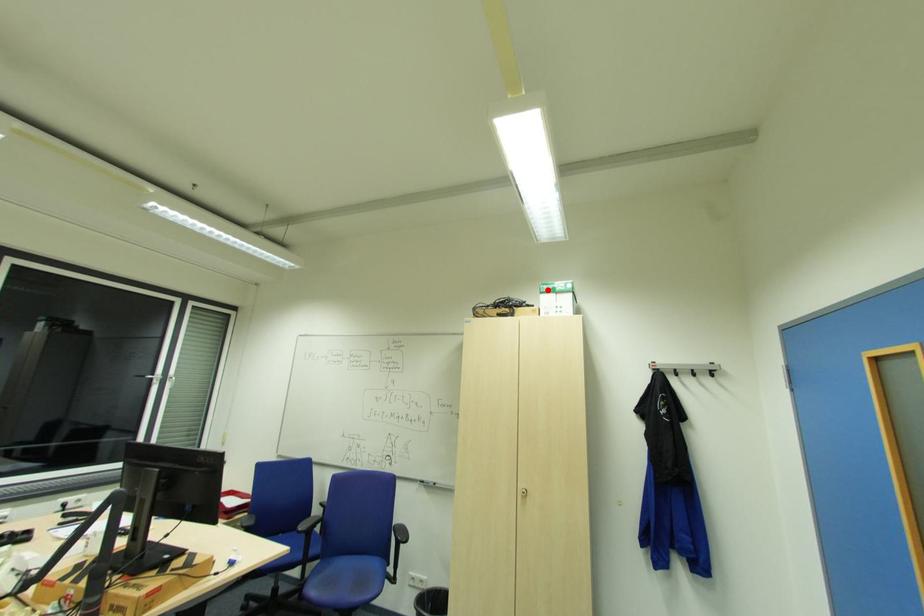
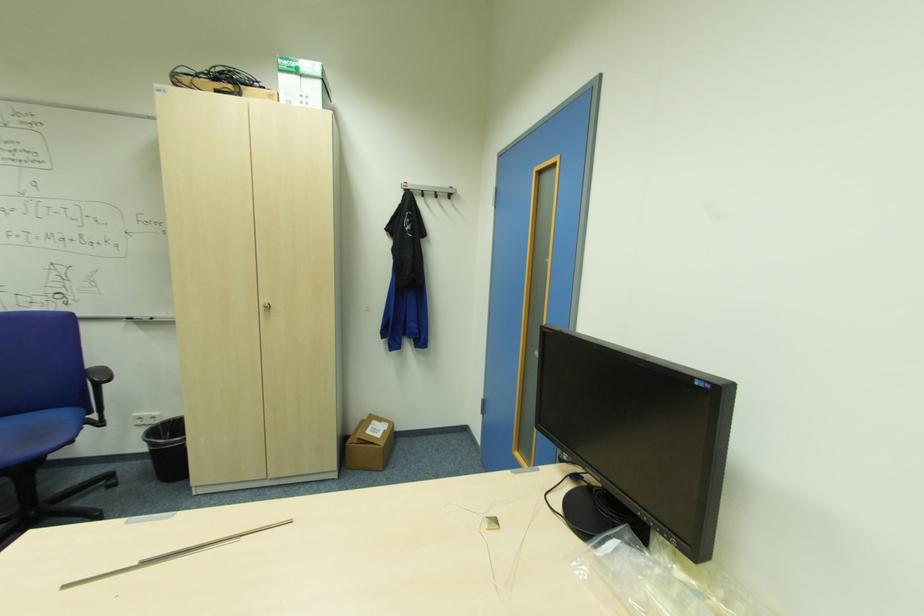
Where in the second image is the point corresponding to the highlighted location from the first image?

(287, 69)